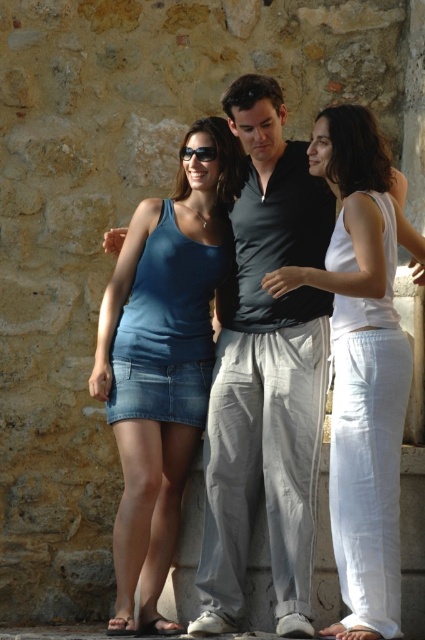
Is blue denim skirt at center shorter than white cotton tank top at center?

No, blue denim skirt at center is not shorter than white cotton tank top at center.

Who is higher up, blue denim skirt at center or white cotton tank top at center?

Positioned higher is blue denim skirt at center.

Which is in front, point (261, 250) or point (377, 189)?

Point (377, 189) is in front.

Image resolution: width=425 pixels, height=640 pixels. I want to click on blue denim skirt at center, so click(266, 356).

Is blue denim skirt at center thinner than black plastic sunglasses at center?

Incorrect, blue denim skirt at center's width is not less than black plastic sunglasses at center's.

Is point (263, 188) farther from camera compared to point (184, 156)?

No.

The height and width of the screenshot is (640, 425). I want to click on blue denim skirt at center, so click(266, 356).

Is denim skirt at center wider than white cotton tank top at center?

No, denim skirt at center is not wider than white cotton tank top at center.

From the picture: Is denim skirt at center taller than white cotton tank top at center?

Yes.

Where is `denim skirt at center`? The height and width of the screenshot is (640, 425). denim skirt at center is located at coordinates (161, 362).